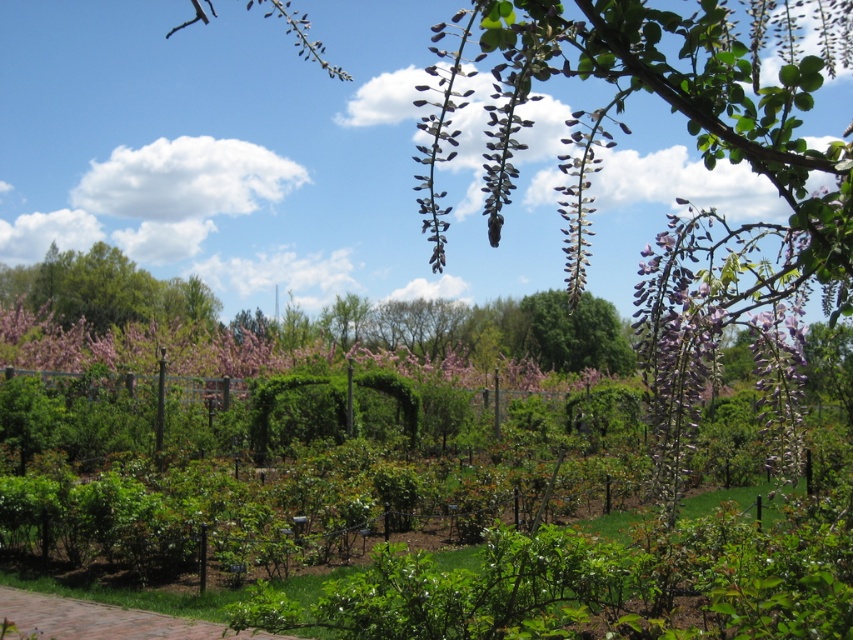
Does green leafy tree at upper left have a greater width compared to brick paved path at lower center?

Yes, green leafy tree at upper left is wider than brick paved path at lower center.

Who is lower down, green leafy tree at upper left or brick paved path at lower center?

brick paved path at lower center is lower down.

Between point (122, 269) and point (183, 628), which one is positioned in front?

Point (183, 628)

Where is `green leafy tree at upper left`? The width and height of the screenshot is (853, 640). green leafy tree at upper left is located at coordinates (94, 285).

Is green leafy tree at upper left shorter than green leafy tree at center?

No, green leafy tree at upper left is not shorter than green leafy tree at center.

Is point (59, 272) less distant than point (622, 364)?

No, (59, 272) is further to viewer.

In order to click on green leafy tree at upper left in this screenshot , I will do `click(94, 285)`.

At what (x,y) coordinates should I click in order to perform the action: click on green leafy tree at upper left. Please return your answer as a coordinate pair (x, y). The width and height of the screenshot is (853, 640). Looking at the image, I should click on (94, 285).

This screenshot has width=853, height=640. What are the coordinates of `pink matte flowers at center` in the screenshot? It's located at (296, 342).

Is point (393, 312) positioned behind point (35, 627)?

Yes, point (393, 312) is farther from viewer.

Does point (496, 328) lie behind point (82, 627)?

Yes, point (496, 328) is behind point (82, 627).

Identify the location of pink matte flowers at center. (296, 342).